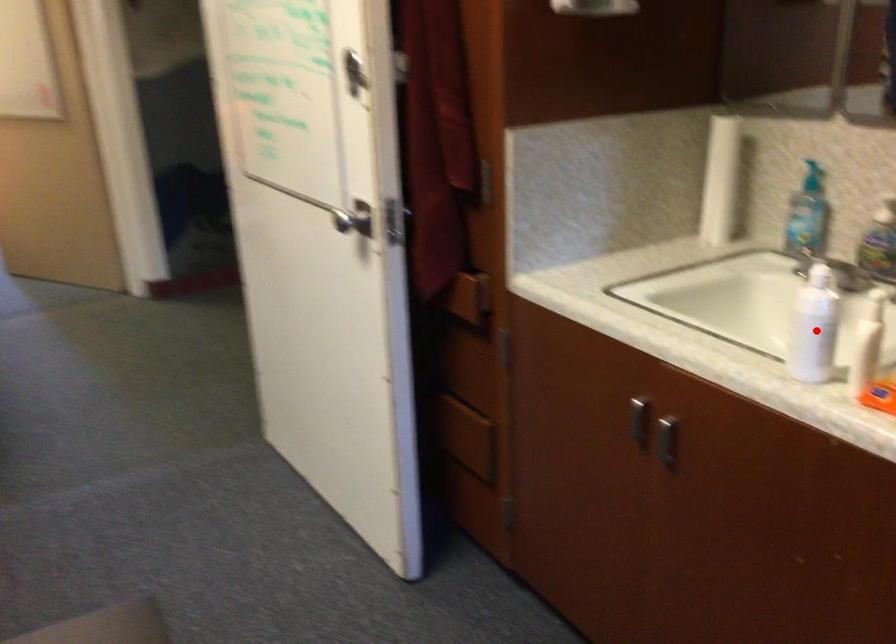
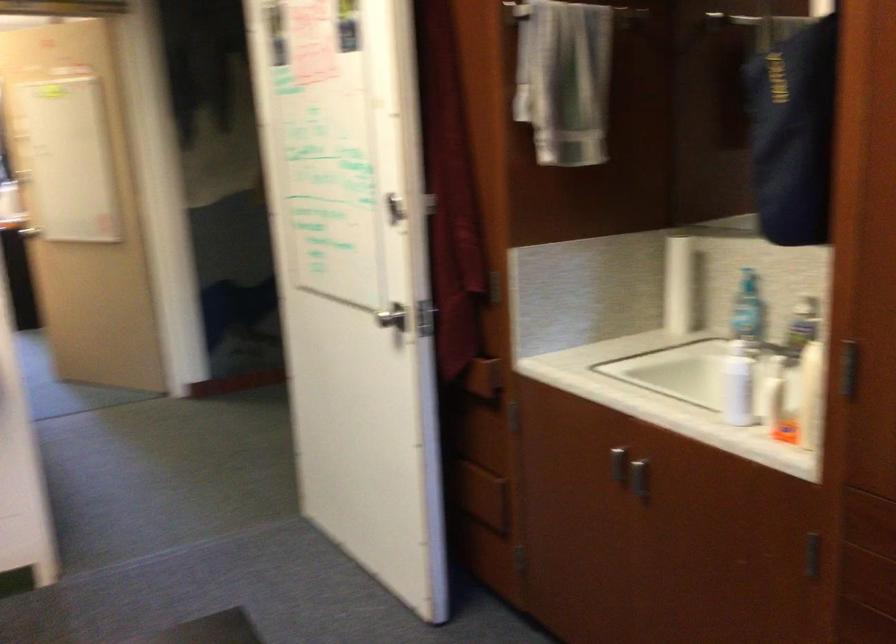
The point at the highlighted location is marked in the first image. Where is the corresponding point in the second image?

(737, 384)